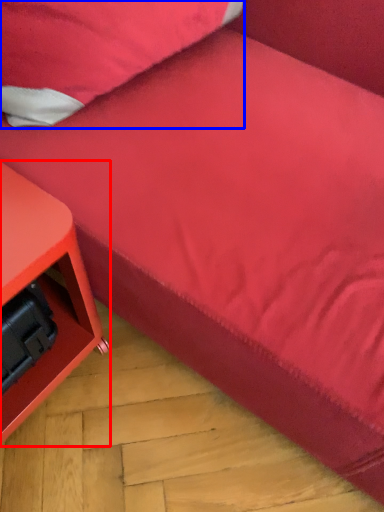
Question: Which object is further to the camera taking this photo, furniture (highlighted by a red box) or pillow (highlighted by a blue box)?

Choices:
 (A) furniture
 (B) pillow

Answer: (B)